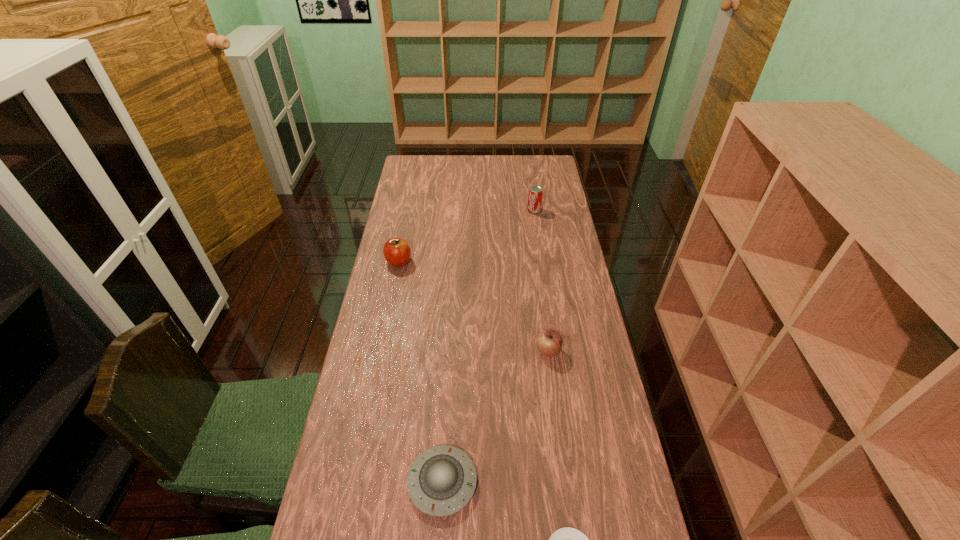
This screenshot has width=960, height=540. I want to click on vacant area situated on the right of the fourth object from right to left, so click(x=590, y=482).

Find the location of a particular element. The height and width of the screenshot is (540, 960). object that is positioned at the left edge is located at coordinates (396, 251).

The height and width of the screenshot is (540, 960). In order to click on soda can positioned at the right edge in this screenshot , I will do `click(535, 194)`.

Locate an element on the screen. The height and width of the screenshot is (540, 960). apple located at the right edge is located at coordinates (549, 342).

Find the location of `vacant space at the far edge`. vacant space at the far edge is located at coordinates (511, 164).

Where is `free space at the left edge of the desktop`? This screenshot has height=540, width=960. free space at the left edge of the desktop is located at coordinates (374, 379).

In the image, there is a desktop. Find the location of `vacant area at the right edge`. vacant area at the right edge is located at coordinates (571, 378).

Identify the location of free space between the farthest object and the second nearest object. (488, 346).

The image size is (960, 540). Find the location of `empty space between the soda can and the second object from left to right`. empty space between the soda can and the second object from left to right is located at coordinates (488, 346).

I want to click on vacant space that is in between the soda can and the third nearest object, so click(x=541, y=281).